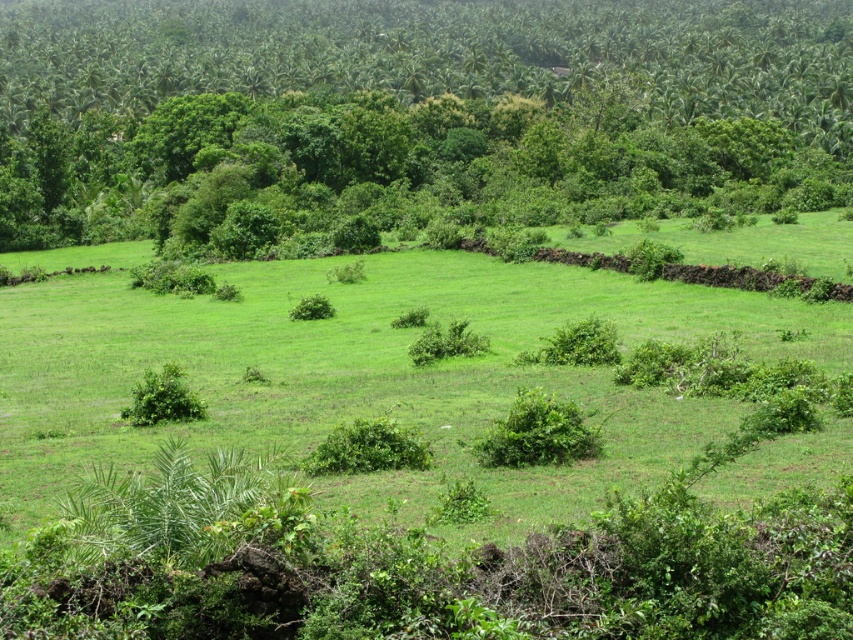
Can you confirm if green grass at center is positioned to the left of green leafy tree at upper center?

Indeed, green grass at center is positioned on the left side of green leafy tree at upper center.

Locate an element on the screen. The width and height of the screenshot is (853, 640). green grass at center is located at coordinates (370, 376).